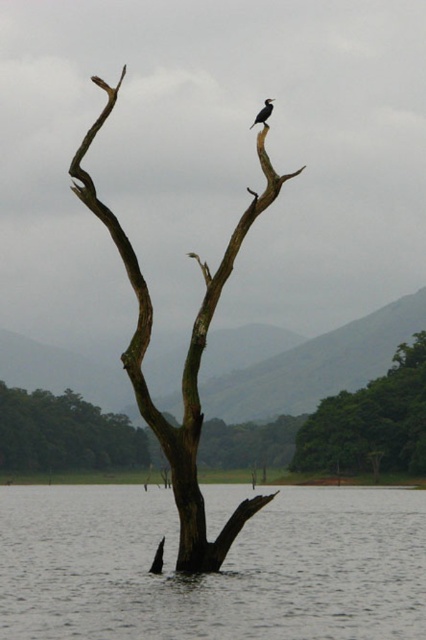
Question: Is brown rough branch at center positioned before green leafy tree at center?

Choices:
 (A) yes
 (B) no

Answer: (A)

Question: Which object is the farthest from the transparent water at tree center?

Choices:
 (A) green leafy tree at center
 (B) brown rough branch at center

Answer: (B)

Question: Does transparent water at tree center appear on the right side of green leafy tree at center?

Choices:
 (A) no
 (B) yes

Answer: (A)

Question: Estimate the real-world distances between objects in this image. Which object is farther from the dark gray feathers at upper center?

Choices:
 (A) green leafy tree at center
 (B) transparent water at tree center
 (C) brown rough branch at center

Answer: (A)

Question: Which is farther from the green leafy tree at center?

Choices:
 (A) brown rough branch at center
 (B) transparent water at tree center

Answer: (A)

Question: Does transparent water at tree center come in front of brown rough branch at center?

Choices:
 (A) no
 (B) yes

Answer: (B)